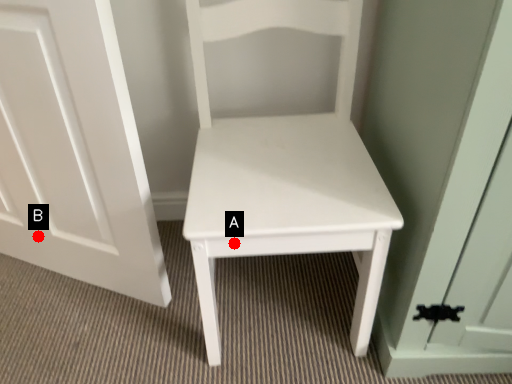
Question: Two points are circled on the image, labeled by A and B beside each circle. Which point is closer to the camera?

Choices:
 (A) A is closer
 (B) B is closer

Answer: (A)